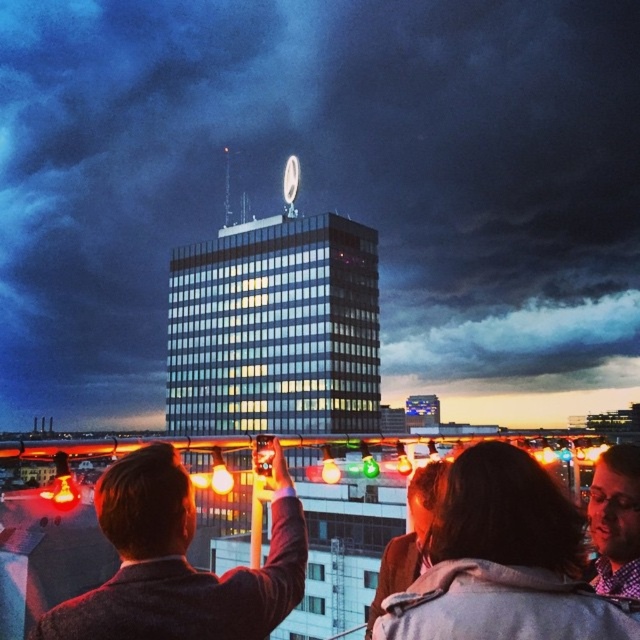
Question: Can you confirm if dark brown hair at center is smaller than smooth brown jacket at upper left?

Choices:
 (A) no
 (B) yes

Answer: (B)

Question: Which point is farther from the camera taking this photo?

Choices:
 (A) (595, 605)
 (B) (609, 451)
 (C) (218, 589)

Answer: (B)

Question: Can you confirm if dark brown hair at center is positioned below smooth brown jacket at upper left?

Choices:
 (A) yes
 (B) no

Answer: (A)

Question: Which point is closer to the camera taking this photo?

Choices:
 (A) (138, 580)
 (B) (605, 516)
 (C) (506, 531)

Answer: (C)

Question: Does smooth brown jacket at upper left appear over plaid shirt at lower right?

Choices:
 (A) yes
 (B) no

Answer: (A)

Question: Which object appears closest to the camera in this image?

Choices:
 (A) smooth brown jacket at upper left
 (B) plaid shirt at lower right

Answer: (A)